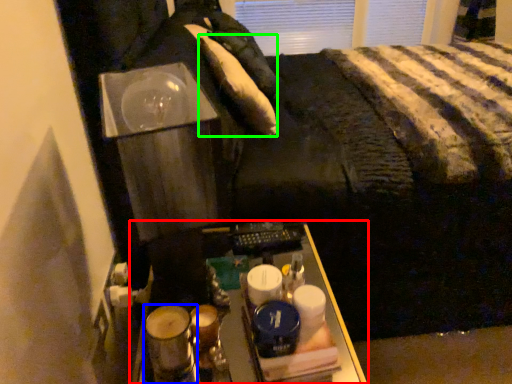
Question: Based on their relative distances, which object is nearer to furniture (highlighted by a red box)? Choose from beverage (highlighted by a blue box) and pillow (highlighted by a green box).

Choices:
 (A) beverage
 (B) pillow

Answer: (A)